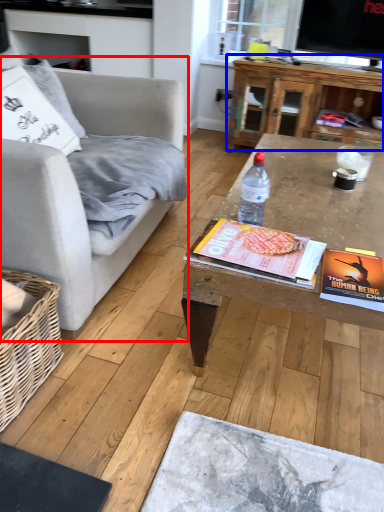
Question: Which object appears farthest to the camera in this image, studio couch (highlighted by a red box) or table (highlighted by a blue box)?

Choices:
 (A) studio couch
 (B) table

Answer: (B)